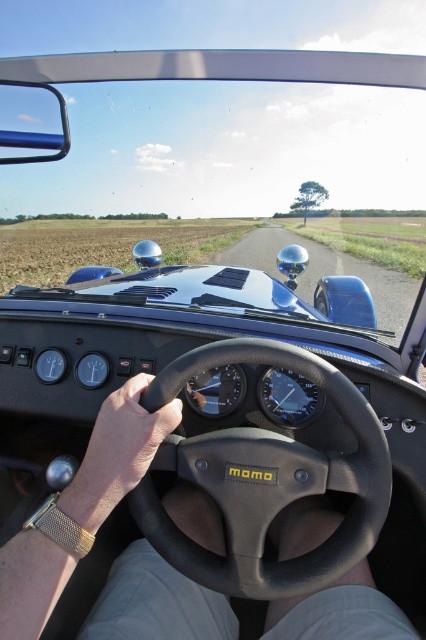
You are a passenger in the car and want to point out the black leather steering wheel at center to the driver. Which direction should you mention relative to the leather at center?

The black leather steering wheel at center is to the right of the leather at center, so you should tell the driver it is on the right side of the leather at center.

You are a passenger in the car and want to know which object is taller between the black leather steering wheel at center and the leather at center. According to the scene, which one is taller?

The black leather steering wheel at center is taller than the leather at center.

You are driving a car and looking through the windshield. You see two points on the road ahead. The first point is at coordinates point (316,380) and the second point is at point (112,413). Which point is closer to your current position?

Point (112,413) is closer to your current position because it is in front of point (316,380), which is behind it.